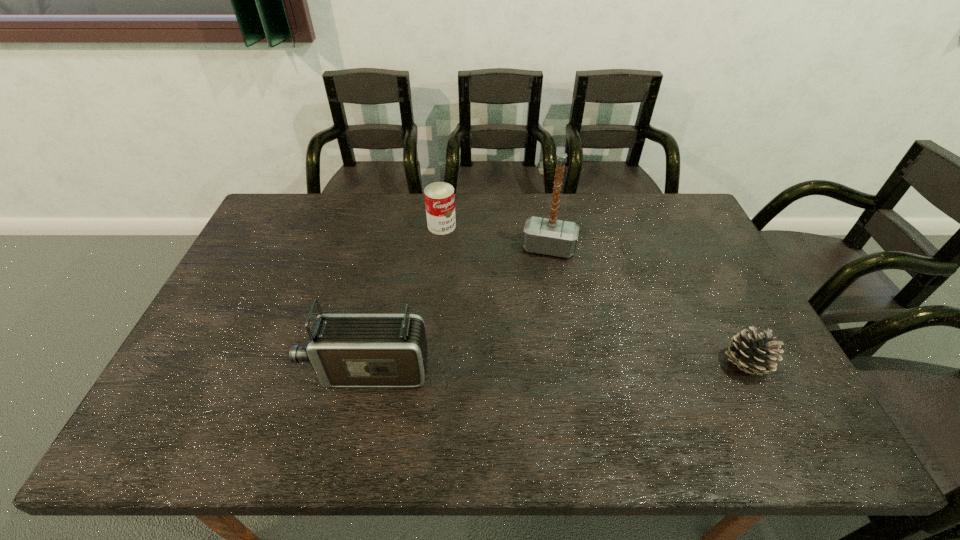
Select which object appears as the second closest to the pinecone. Please provide its 2D coordinates. Your answer should be formatted as a tuple, i.e. [(x, y)], where the tuple contains the x and y coordinates of a point satisfying the conditions above.

[(345, 350)]

Identify the location of object that is the second closest to the farthest object. This screenshot has height=540, width=960. (345, 350).